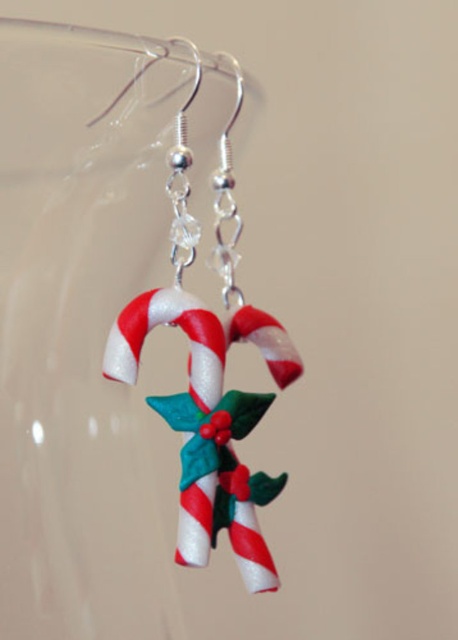
Looking at this image, can you confirm if transparent glass vase at center is smaller than shiny plastic candy cane at center?

Actually, transparent glass vase at center might be larger than shiny plastic candy cane at center.

Is transparent glass vase at center further to camera compared to shiny plastic candy cane at center?

No, it is in front of shiny plastic candy cane at center.

Find the location of `transparent glass vase at center`. transparent glass vase at center is located at coordinates (124, 340).